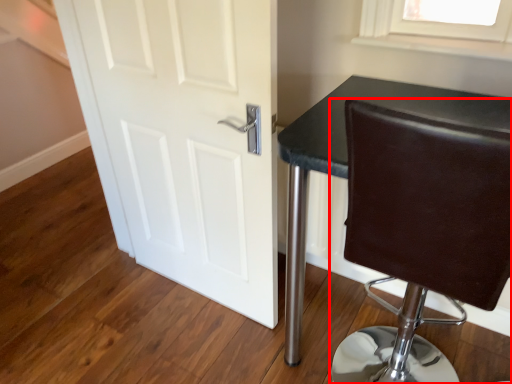
Question: Considering the relative positions of chair (annotated by the red box) and door in the image provided, where is chair (annotated by the red box) located with respect to the staircase?

Choices:
 (A) left
 (B) right

Answer: (B)